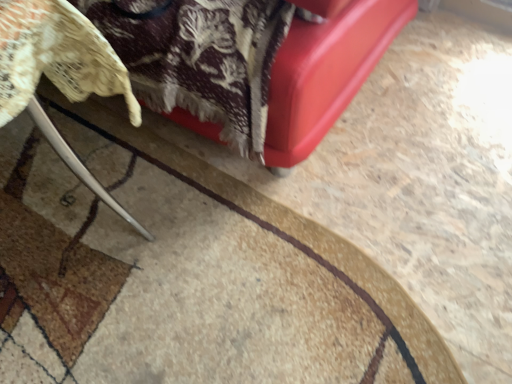
Where is `carpeted mat at lower left`? This screenshot has height=384, width=512. carpeted mat at lower left is located at coordinates (184, 275).

What do you see at coordinates (184, 275) in the screenshot?
I see `carpeted mat at lower left` at bounding box center [184, 275].

Describe the element at coordinates (59, 73) in the screenshot. I see `metallic silver chair at lower left` at that location.

The width and height of the screenshot is (512, 384). In order to click on metallic silver chair at lower left in this screenshot , I will do `click(59, 73)`.

Locate an element on the screen. The width and height of the screenshot is (512, 384). carpeted mat at lower left is located at coordinates (184, 275).

Does carpeted mat at lower left appear on the right side of metallic silver chair at lower left?

Indeed, carpeted mat at lower left is positioned on the right side of metallic silver chair at lower left.

Considering the positions of objects carpeted mat at lower left and metallic silver chair at lower left in the image provided, who is behind, carpeted mat at lower left or metallic silver chair at lower left?

carpeted mat at lower left is further away from the camera.

Which is nearer, (212, 377) or (105, 86)?

Clearly, point (212, 377) is more distant from the camera than point (105, 86).

From the image's perspective, which one is positioned higher, carpeted mat at lower left or metallic silver chair at lower left?

metallic silver chair at lower left, from the image's perspective.

From a real-world perspective, between carpeted mat at lower left and metallic silver chair at lower left, who is vertically higher?

metallic silver chair at lower left, from a real-world perspective.

Which object is wider, carpeted mat at lower left or metallic silver chair at lower left?

carpeted mat at lower left.

Which of these two, carpeted mat at lower left or metallic silver chair at lower left, stands taller?

Standing taller between the two is metallic silver chair at lower left.

Which of these two, carpeted mat at lower left or metallic silver chair at lower left, is smaller?

carpeted mat at lower left.

Is carpeted mat at lower left located outside metallic silver chair at lower left?

That's correct, carpeted mat at lower left is outside of metallic silver chair at lower left.

Is carpeted mat at lower left next to metallic silver chair at lower left?

carpeted mat at lower left is not next to metallic silver chair at lower left, and they're not touching.

Is carpeted mat at lower left oriented away from metallic silver chair at lower left?

No, carpeted mat at lower left's orientation is not away from metallic silver chair at lower left.

Can you tell me how much carpeted mat at lower left and metallic silver chair at lower left differ in facing direction?

0.171 degrees separate the facing orientations of carpeted mat at lower left and metallic silver chair at lower left.

This screenshot has height=384, width=512. In order to click on furniture above the carpeted mat at lower left (from a real-world perspective) in this screenshot , I will do `click(59, 73)`.

Which object is positioned more to the right, metallic silver chair at lower left or carpeted mat at lower left?

Positioned to the right is carpeted mat at lower left.

Between metallic silver chair at lower left and carpeted mat at lower left, which one is positioned behind?

carpeted mat at lower left is further from the camera.

Does point (132, 100) come closer to viewer compared to point (64, 183)?

That is True.

From the image's perspective, is metallic silver chair at lower left beneath carpeted mat at lower left?

No.

From a real-world perspective, which is physically below, metallic silver chair at lower left or carpeted mat at lower left?

From a 3D spatial view, carpeted mat at lower left is below.

Which object is wider, metallic silver chair at lower left or carpeted mat at lower left?

Wider between the two is carpeted mat at lower left.

Can you confirm if metallic silver chair at lower left is taller than carpeted mat at lower left?

Correct, metallic silver chair at lower left is much taller as carpeted mat at lower left.

Which of these two, metallic silver chair at lower left or carpeted mat at lower left, is smaller?

carpeted mat at lower left is smaller.

Is metallic silver chair at lower left inside the boundaries of carpeted mat at lower left, or outside?

metallic silver chair at lower left cannot be found inside carpeted mat at lower left.

Is metallic silver chair at lower left in contact with carpeted mat at lower left?

metallic silver chair at lower left is not next to carpeted mat at lower left, and they're not touching.

Could you tell me if metallic silver chair at lower left is turned towards carpeted mat at lower left?

No.

Image resolution: width=512 pixels, height=384 pixels. Identify the location of furniture in front of the carpeted mat at lower left. (59, 73).

Identify the location of furniture on the left of carpeted mat at lower left. (59, 73).

At what (x,y) coordinates should I click in order to perform the action: click on furniture positioned vertically above the carpeted mat at lower left (from a real-world perspective). Please return your answer as a coordinate pair (x, y). Looking at the image, I should click on (59, 73).